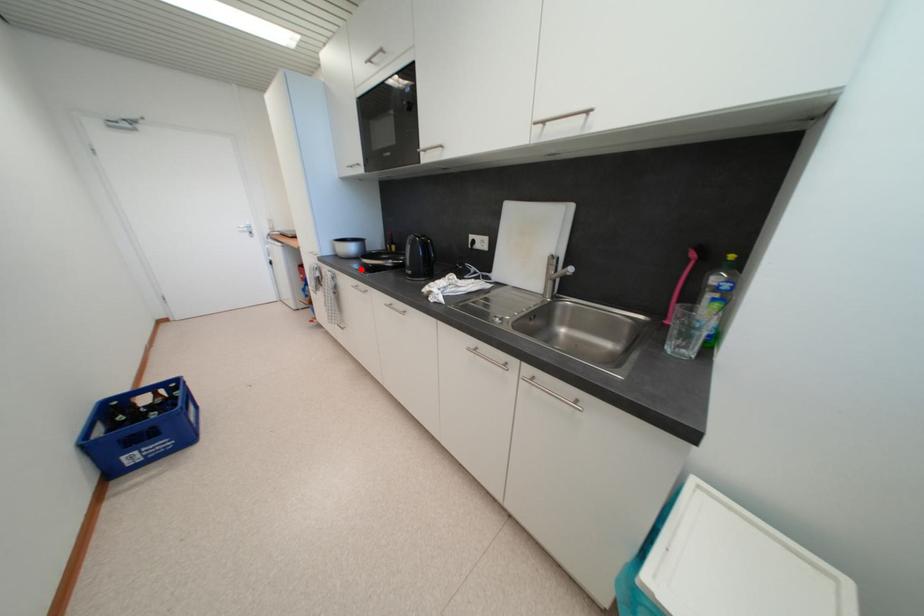
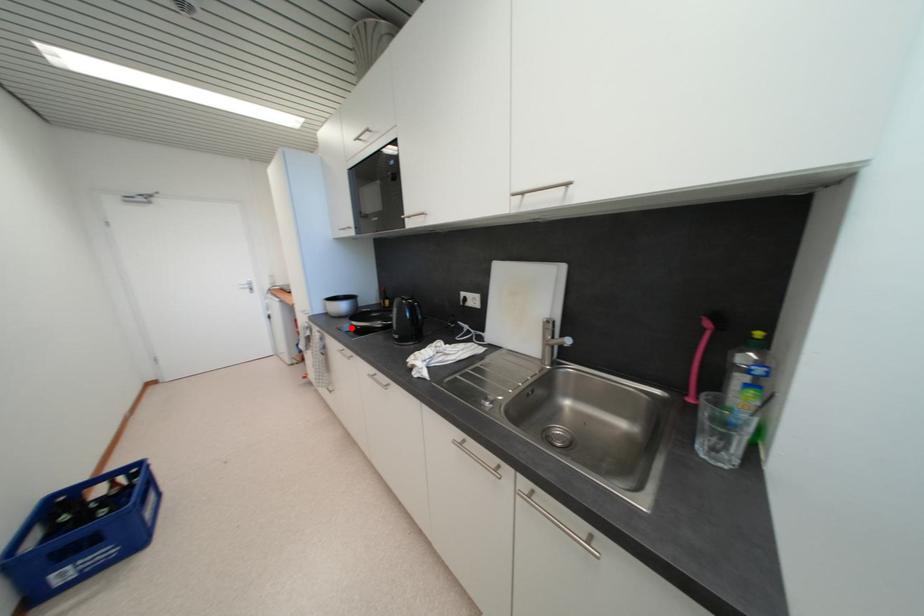
I am providing you with two images of the same scene from different viewpoints. A red point is marked on the first image and another point is marked on the second image. Do the highlighted points in image1 and image2 indicate the same real-world spot?

Yes